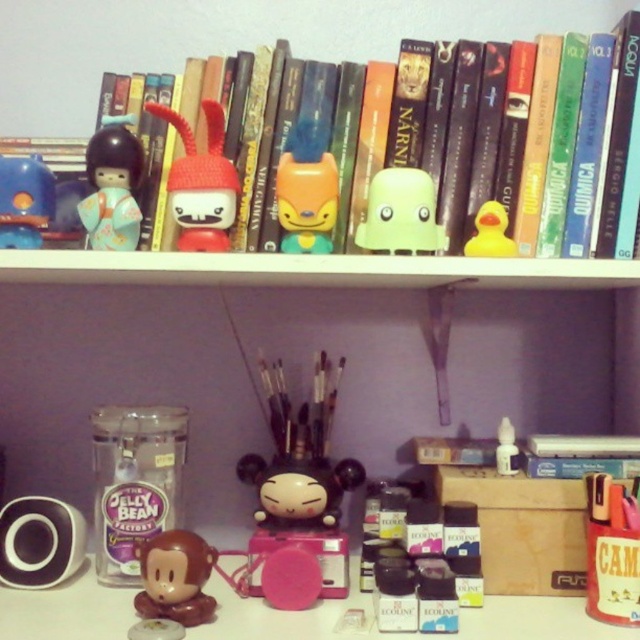
The height and width of the screenshot is (640, 640). What are the coordinates of `matte porcelain figurine at upper left` in the screenshot? It's located at (113, 188).

Does matte porcelain figurine at upper left have a lesser height compared to matte blue rubber duck at upper left?

In fact, matte porcelain figurine at upper left may be taller than matte blue rubber duck at upper left.

What are the coordinates of `matte porcelain figurine at upper left` in the screenshot? It's located at (113, 188).

You are a GUI agent. You are given a task and a screenshot of the screen. Output one action in this format:
    pyautogui.click(x=<x>, y=<y>)
    Task: Click on the matte porcelain figurine at upper left
    
    Given the screenshot: What is the action you would take?
    pyautogui.click(x=113, y=188)

Between knitted fabric toy at center and green matte toy at center, which one has less height?

Standing shorter between the two is green matte toy at center.

The image size is (640, 640). Identify the location of knitted fabric toy at center. (200, 182).

Between matte blue rubber duck at upper left and yellow rubber duck at upper center, which one has more height?

With more height is matte blue rubber duck at upper left.

Can you confirm if matte blue rubber duck at upper left is positioned below yellow rubber duck at upper center?

Actually, matte blue rubber duck at upper left is above yellow rubber duck at upper center.

Which is in front, point (38, 184) or point (500, 211)?

Positioned in front is point (500, 211).

At what (x,y) coordinates should I click in order to perform the action: click on matte blue rubber duck at upper left. Please return your answer as a coordinate pair (x, y). The image size is (640, 640). Looking at the image, I should click on (24, 200).